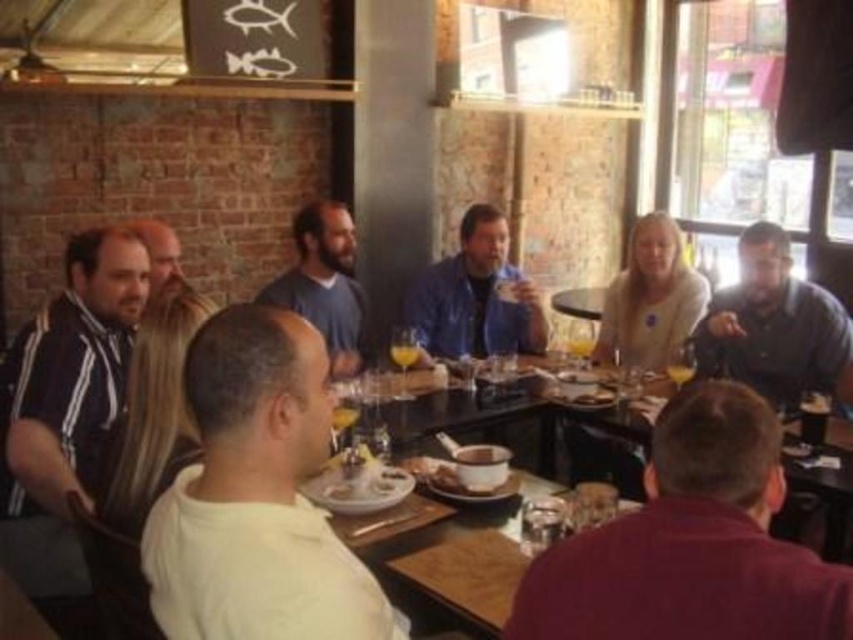
You are a waiter at the restaurant and need to place a new dish on the table. There is a blue denim jacket at center and a dark blue sweater at center. Which item should you move to make more space for the dish?

You should move the dark blue sweater at center because it occupies more space than the blue denim jacket at center, allowing for more space to place the dish.

You are standing at the edge of the table in the dining scene. There are two points marked on the table surface. The first point is at coordinates point (113, 355) and the second point is at point (363, 461). If you want to place a small vase between these two points so it is closer to the viewer, where should you position it?

To place the small vase closer to the viewer between point (113, 355) and point (363, 461), position it near point (113, 355) since it is closer to the viewer compared to the other point.